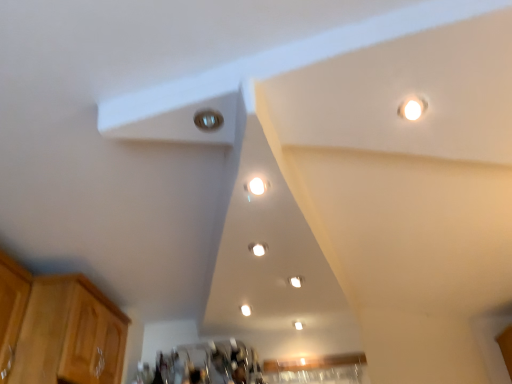
What are the coordinates of `white glossy light fixture at center, acting as the 3th dot starting from the back` in the screenshot? It's located at (257, 186).

The image size is (512, 384). Identify the location of metallic silver light at upper center. (208, 120).

Where is `light brown wood cabinet at lower left`? Image resolution: width=512 pixels, height=384 pixels. light brown wood cabinet at lower left is located at coordinates (58, 329).

Is white glossy light fixture at center, acting as the first dot starting from the top, not near light brown wood cabinet at lower left?

Indeed, white glossy light fixture at center, acting as the first dot starting from the top, is not near light brown wood cabinet at lower left.

Considering the positions of points (252, 190) and (93, 310), is point (252, 190) farther from camera compared to point (93, 310)?

No.

Does white glossy light fixture at center, marked as the 1th dot in a left-to-right arrangement, turn towards light brown wood cabinet at lower left?

No, white glossy light fixture at center, marked as the 1th dot in a left-to-right arrangement, is not aimed at light brown wood cabinet at lower left.

Could you tell me if white glossy light fixture at center, arranged as the 1th dot when ordered from the bottom, is turned towards metallic silver light at upper center?

Yes, white glossy light fixture at center, arranged as the 1th dot when ordered from the bottom, is facing metallic silver light at upper center.

Is white glossy light fixture at center, which ranks as the first dot in right-to-left order, positioned far away from metallic silver light at upper center?

No.

Considering the relative sizes of white glossy light fixture at center, the 3th dot positioned from the front, and metallic silver light at upper center in the image provided, is white glossy light fixture at center, the 3th dot positioned from the front, shorter than metallic silver light at upper center?

In fact, white glossy light fixture at center, the 3th dot positioned from the front, may be taller than metallic silver light at upper center.

Can you confirm if white glossy light fixture at center, which ranks as the 3th dot in top-to-bottom order, is positioned to the right of metallic silver light at upper center?

Yes, white glossy light fixture at center, which ranks as the 3th dot in top-to-bottom order, is to the right of metallic silver light at upper center.

Based on the photo, which object is wider, matte white light fixture at center, acting as the second dot starting from the right, or white glossy light fixture at center, acting as the 3th dot starting from the back?

white glossy light fixture at center, acting as the 3th dot starting from the back.

Is matte white light fixture at center, the second dot viewed from the left, far from white glossy light fixture at center, which ranks as the third dot in bottom-to-top order?

matte white light fixture at center, the second dot viewed from the left, is actually quite close to white glossy light fixture at center, which ranks as the third dot in bottom-to-top order.

Relative to white glossy light fixture at center, acting as the first dot starting from the top, is matte white light fixture at center, the second dot positioned from the top, in front or behind?

matte white light fixture at center, the second dot positioned from the top, is positioned farther from the viewer than white glossy light fixture at center, acting as the first dot starting from the top.

Does matte white light fixture at center, arranged as the second dot when ordered from the bottom, appear on the right side of white glossy light fixture at center, acting as the 3th dot starting from the back?

Indeed, matte white light fixture at center, arranged as the second dot when ordered from the bottom, is positioned on the right side of white glossy light fixture at center, acting as the 3th dot starting from the back.

Is metallic silver light at upper center located outside white glossy light fixture at center, marked as the 1th dot in a left-to-right arrangement?

Yes, metallic silver light at upper center is outside of white glossy light fixture at center, marked as the 1th dot in a left-to-right arrangement.

Looking at this image, does metallic silver light at upper center come behind white glossy light fixture at center, acting as the 3th dot starting from the back?

No, it is in front of white glossy light fixture at center, acting as the 3th dot starting from the back.

Consider the image. Between metallic silver light at upper center and white glossy light fixture at center, which is the 1th dot from front to back, which one has smaller width?

With smaller width is white glossy light fixture at center, which is the 1th dot from front to back.

From their relative heights in the image, would you say metallic silver light at upper center is taller or shorter than white glossy light fixture at center, marked as the 1th dot in a left-to-right arrangement?

metallic silver light at upper center is shorter than white glossy light fixture at center, marked as the 1th dot in a left-to-right arrangement.

Between metallic silver light at upper center and white glossy light fixture at center, positioned as the third dot in left-to-right order, which one appears on the right side from the viewer's perspective?

Positioned to the right is white glossy light fixture at center, positioned as the third dot in left-to-right order.

What's the angular difference between metallic silver light at upper center and white glossy light fixture at center, positioned as the third dot in left-to-right order,'s facing directions?

The angular difference between metallic silver light at upper center and white glossy light fixture at center, positioned as the third dot in left-to-right order, is 101 degrees.

Who is bigger, metallic silver light at upper center or white glossy light fixture at center, positioned as the third dot in left-to-right order?

white glossy light fixture at center, positioned as the third dot in left-to-right order, is bigger.

Considering the relative sizes of light brown wood cabinet at lower left and matte white light fixture at center, the second dot positioned from the top, in the image provided, is light brown wood cabinet at lower left wider than matte white light fixture at center, the second dot positioned from the top,?

Indeed, light brown wood cabinet at lower left has a greater width compared to matte white light fixture at center, the second dot positioned from the top.

From a real-world perspective, count 2nd dots upward from the light brown wood cabinet at lower left and point to it. Please provide its 2D coordinates.

[(258, 248)]

Is light brown wood cabinet at lower left smaller than matte white light fixture at center, the second dot viewed from the left?

Actually, light brown wood cabinet at lower left might be larger than matte white light fixture at center, the second dot viewed from the left.

Which is more to the left, light brown wood cabinet at lower left or matte white light fixture at center, which is counted as the second dot, starting from the front?

light brown wood cabinet at lower left.

Is metallic silver light at upper center far away from light brown wood cabinet at lower left?

metallic silver light at upper center is far away from light brown wood cabinet at lower left.

Is metallic silver light at upper center oriented towards light brown wood cabinet at lower left?

No, metallic silver light at upper center is not turned towards light brown wood cabinet at lower left.

Can you confirm if metallic silver light at upper center is thinner than light brown wood cabinet at lower left?

Correct, the width of metallic silver light at upper center is less than that of light brown wood cabinet at lower left.

Looking at this image, would you say metallic silver light at upper center contains light brown wood cabinet at lower left?

No, light brown wood cabinet at lower left is not inside metallic silver light at upper center.

From the image's perspective, starting from the light brown wood cabinet at lower left, which dot is the 3rd one above? Please provide its 2D coordinates.

[(257, 186)]

At what (x,y) coordinates should I click in order to perform the action: click on the 3rd dot behind the metallic silver light at upper center, starting your count from the anchor. Please return your answer as a coordinate pair (x, y). Looking at the image, I should click on (296, 281).

Considering their positions, is light brown wood cabinet at lower left positioned closer to matte white light fixture at center, which is counted as the second dot, starting from the front, than white glossy light fixture at center, marked as the 1th dot in a left-to-right arrangement?

white glossy light fixture at center, marked as the 1th dot in a left-to-right arrangement, is closer to matte white light fixture at center, which is counted as the second dot, starting from the front.

Considering their positions, is matte white light fixture at center, the second dot viewed from the left, positioned further to white glossy light fixture at center, which ranks as the third dot in bottom-to-top order, than metallic silver light at upper center?

The object further to white glossy light fixture at center, which ranks as the third dot in bottom-to-top order, is matte white light fixture at center, the second dot viewed from the left.

In the scene shown: From the image, which object appears to be farther from white glossy light fixture at center, which ranks as the 3th dot in top-to-bottom order, light brown wood cabinet at lower left or matte white light fixture at center, acting as the second dot starting from the right?

Based on the image, light brown wood cabinet at lower left appears to be further to white glossy light fixture at center, which ranks as the 3th dot in top-to-bottom order.

Based on their spatial positions, is white glossy light fixture at center, the 3th dot positioned from the front, or matte white light fixture at center, the second dot positioned from the top, further from light brown wood cabinet at lower left?

white glossy light fixture at center, the 3th dot positioned from the front, is positioned further to the anchor light brown wood cabinet at lower left.

From the image, which object appears to be nearer to matte white light fixture at center, which is counted as the second dot, starting from the front, white glossy light fixture at center, acting as the 3th dot starting from the back, or metallic silver light at upper center?

Based on the image, white glossy light fixture at center, acting as the 3th dot starting from the back, appears to be nearer to matte white light fixture at center, which is counted as the second dot, starting from the front.

Based on the photo, considering their positions, is light brown wood cabinet at lower left positioned further to white glossy light fixture at center, acting as the 3th dot starting from the back, than white glossy light fixture at center, which ranks as the 3th dot in top-to-bottom order?

light brown wood cabinet at lower left lies further to white glossy light fixture at center, acting as the 3th dot starting from the back, than the other object.

When comparing their distances from white glossy light fixture at center, acting as the first dot starting from the top, does white glossy light fixture at center, which ranks as the first dot in right-to-left order, or matte white light fixture at center, the second dot when ordered from back to front, seem further?

The object further to white glossy light fixture at center, acting as the first dot starting from the top, is white glossy light fixture at center, which ranks as the first dot in right-to-left order.

Estimate the real-world distances between objects in this image. Which object is further from white glossy light fixture at center, which is the 1th dot from front to back, metallic silver light at upper center or light brown wood cabinet at lower left?

The object further to white glossy light fixture at center, which is the 1th dot from front to back, is light brown wood cabinet at lower left.

Where is `dot between light brown wood cabinet at lower left and matte white light fixture at center, acting as the second dot starting from the right, from left to right`? The height and width of the screenshot is (384, 512). dot between light brown wood cabinet at lower left and matte white light fixture at center, acting as the second dot starting from the right, from left to right is located at coordinates (257, 186).

Find the location of a particular element. dot located between metallic silver light at upper center and matte white light fixture at center, the second dot when ordered from back to front, in the depth direction is located at coordinates (257, 186).

At what (x,y) coordinates should I click in order to perform the action: click on light between light brown wood cabinet at lower left and white glossy light fixture at center, which is counted as the first dot, starting from the back, from left to right. Please return your answer as a coordinate pair (x, y). The height and width of the screenshot is (384, 512). Looking at the image, I should click on (208, 120).

Image resolution: width=512 pixels, height=384 pixels. In order to click on dot between white glossy light fixture at center, acting as the 3th dot starting from the back, and white glossy light fixture at center, positioned as the third dot in left-to-right order, in the front-back direction in this screenshot , I will do `click(258, 248)`.